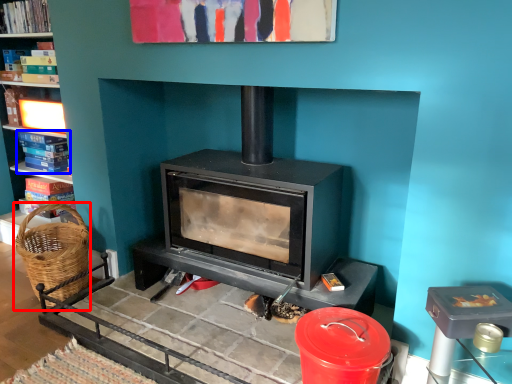
Question: Which of the following is the closest to the observer, basket (highlighted by a red box) or book (highlighted by a blue box)?

Choices:
 (A) basket
 (B) book

Answer: (A)